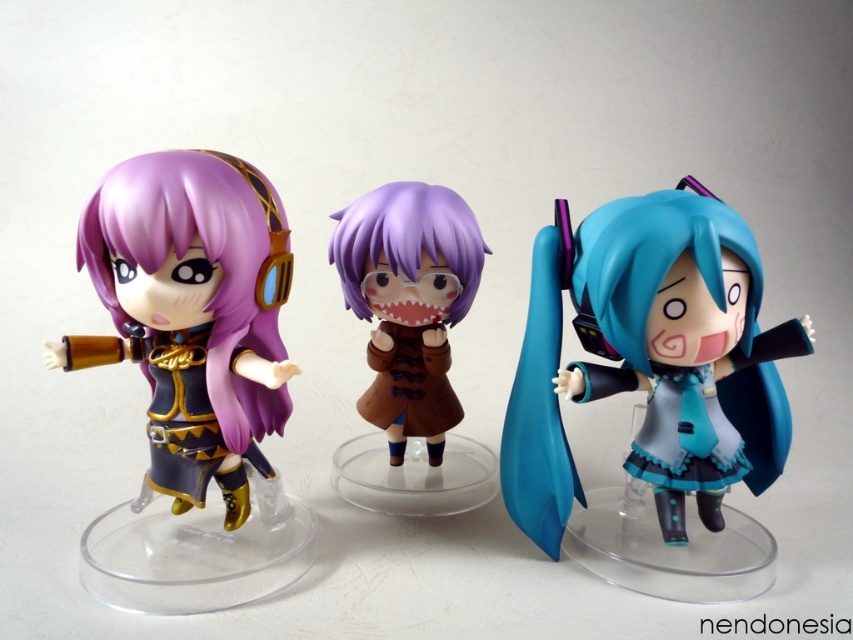
Can you confirm if matte purple doll at left is positioned to the left of purple glossy doll at center?

Correct, you'll find matte purple doll at left to the left of purple glossy doll at center.

Locate an element on the screen. The image size is (853, 640). matte purple doll at left is located at coordinates (190, 312).

Between point (85, 237) and point (351, 241), which one is positioned behind?

The point (351, 241) is more distant.

The image size is (853, 640). I want to click on matte purple doll at left, so click(190, 312).

Is teal glossy figure at center smaller than purple glossy doll at center?

Actually, teal glossy figure at center might be larger than purple glossy doll at center.

Who is more distant from viewer, (653,266) or (401,417)?

The point (401,417) is behind.

Who is more forward, (645, 586) or (403, 193)?

Point (645, 586) is in front.

At what (x,y) coordinates should I click in order to perform the action: click on teal glossy figure at center. Please return your answer as a coordinate pair (x, y). This screenshot has height=640, width=853. Looking at the image, I should click on (656, 394).

Consider the image. Between teal glossy figure at center and matte purple doll at left, which one appears on the left side from the viewer's perspective?

matte purple doll at left

Looking at this image, between teal glossy figure at center and matte purple doll at left, which one has more height?

With more height is teal glossy figure at center.

Between point (767, 474) and point (181, 508), which one is positioned in front?

Positioned in front is point (181, 508).

This screenshot has height=640, width=853. In order to click on teal glossy figure at center in this screenshot , I will do `click(656, 394)`.